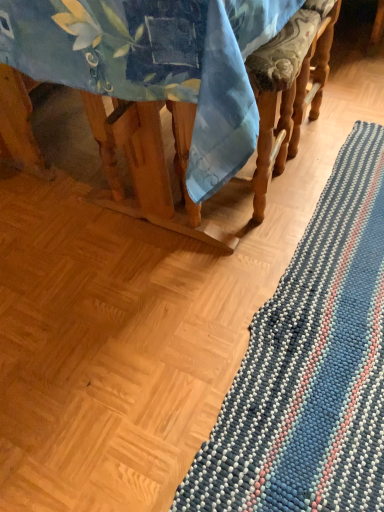
Question: Looking at the image, does blue fabric tablecloth at upper left seem bigger or smaller compared to blue striped rug at lower right?

Choices:
 (A) small
 (B) big

Answer: (B)

Question: Is point (147, 15) closer or farther from the camera than point (289, 347)?

Choices:
 (A) closer
 (B) farther

Answer: (A)

Question: Based on their positions, is blue fabric tablecloth at upper left located to the left or right of blue striped rug at lower right?

Choices:
 (A) right
 (B) left

Answer: (B)

Question: In the image, is blue striped rug at lower right on the left side or the right side of blue fabric tablecloth at upper left?

Choices:
 (A) left
 (B) right

Answer: (B)

Question: Considering the positions of blue striped rug at lower right and blue fabric tablecloth at upper left in the image, is blue striped rug at lower right wider or thinner than blue fabric tablecloth at upper left?

Choices:
 (A) wide
 (B) thin

Answer: (B)

Question: Would you say blue striped rug at lower right is inside or outside blue fabric tablecloth at upper left?

Choices:
 (A) outside
 (B) inside

Answer: (A)

Question: Is blue striped rug at lower right in front of or behind blue fabric tablecloth at upper left in the image?

Choices:
 (A) behind
 (B) front

Answer: (A)